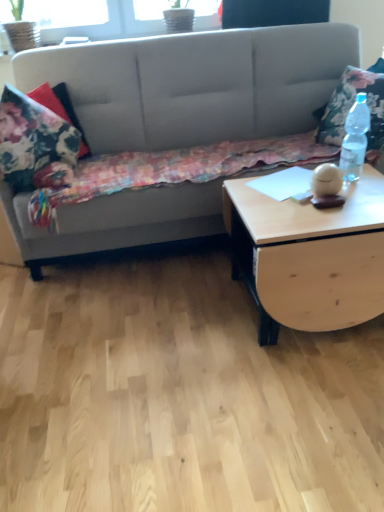
The image size is (384, 512). What are the coordinates of `free space above light wood/texture coffee table at right (from a real-world perspective)` in the screenshot? It's located at 306,191.